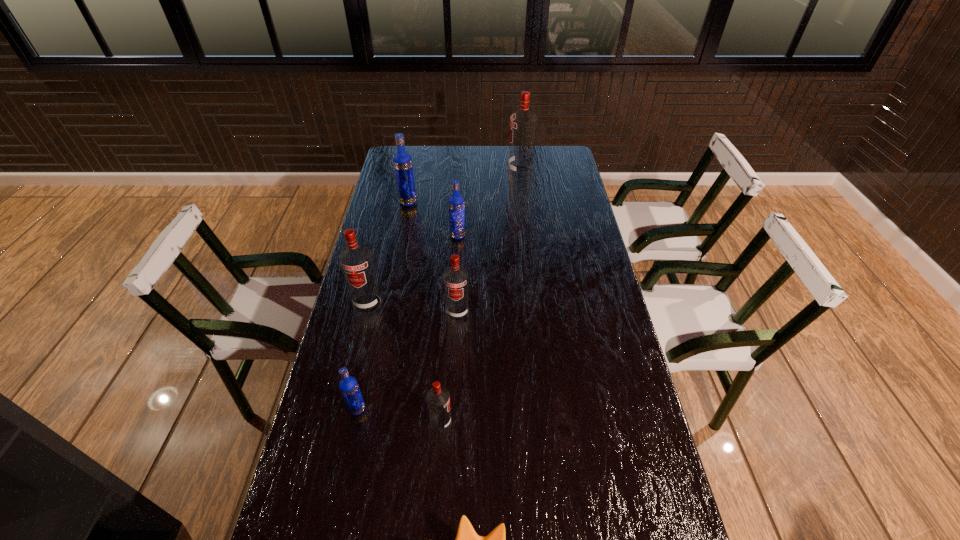
Locate an element on the screen. free spot located on the front label of the tallest object is located at coordinates (439, 172).

You are a GUI agent. You are given a task and a screenshot of the screen. Output one action in this format:
    pyautogui.click(x=<x>, y=<y>)
    Task: Click on the vacant position located on the front label of the tallest object
    The height and width of the screenshot is (540, 960).
    Given the screenshot: What is the action you would take?
    pyautogui.click(x=435, y=172)

The height and width of the screenshot is (540, 960). What are the coordinates of `blank space located on the front label of the tallest object` in the screenshot? It's located at (496, 172).

Find the location of a particular element. This screenshot has height=540, width=960. vacant space located on the back of the biggest blue vodka is located at coordinates (416, 163).

Locate an element on the screen. free space located on the front label of the third smallest red vodka is located at coordinates (358, 342).

This screenshot has height=540, width=960. What are the coordinates of `blank space located 0.230m on the back of the rightmost blue vodka` in the screenshot? It's located at (460, 197).

Find the location of a particular element. The image size is (960, 540). free space located on the front label of the second smallest red vodka is located at coordinates (452, 420).

Locate an element on the screen. This screenshot has width=960, height=540. vacant space located 0.240m on the back of the smallest blue vodka is located at coordinates (374, 331).

Find the location of a particular element. This screenshot has height=540, width=960. vacant space located on the front label of the nearest red vodka is located at coordinates (533, 422).

Locate an element on the screen. object at the far edge is located at coordinates (523, 123).